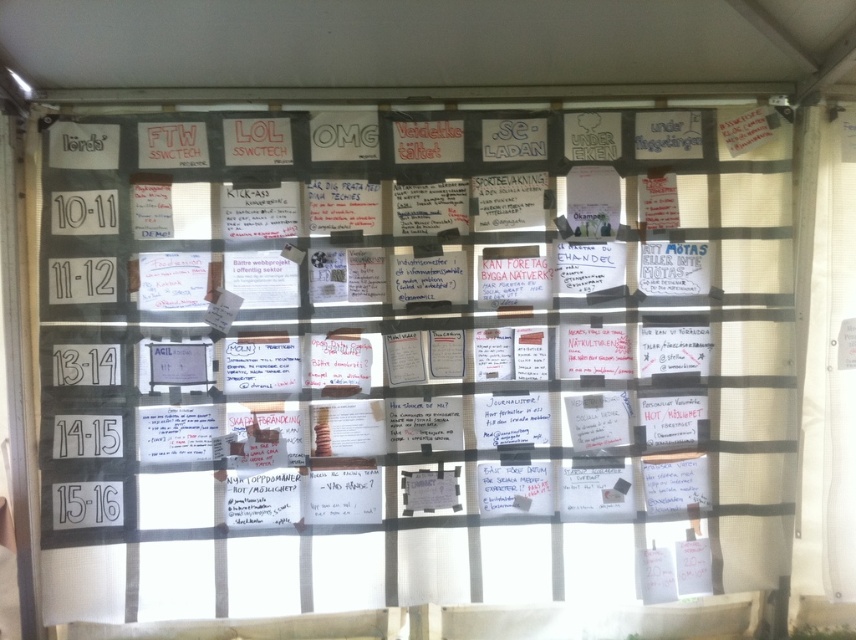
You are organizing a school event and need to hang decorations. You have a roll of ribbon that is 1 meter wide. You want to place it on the display board so it covers the widest object. Which object should you choose between the white paper notes at center and the white sheer curtain at right?

The white paper notes at center has a larger width than the white sheer curtain at right, so you should place the ribbon over the white paper notes at center to cover the widest object.

You are standing in front of the display board and want to touch both the point at coordinates (676, 324) and the point at (824, 198). Which point will you reach first?

You will reach the point at coordinates (676, 324) first because it is closer to you than the point at (824, 198), which is further away.